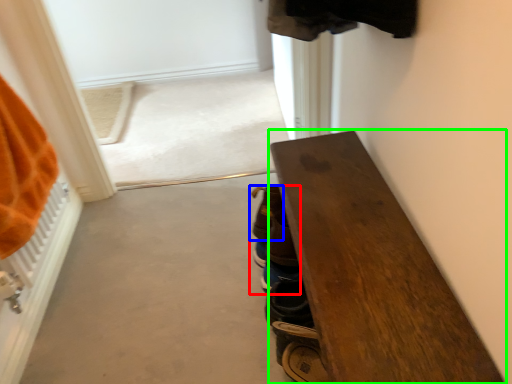
Question: Which object is the closest to the footwear (highlighted by a red box)? Choose among these: footwear (highlighted by a blue box) or furniture (highlighted by a green box).

Choices:
 (A) footwear
 (B) furniture

Answer: (A)